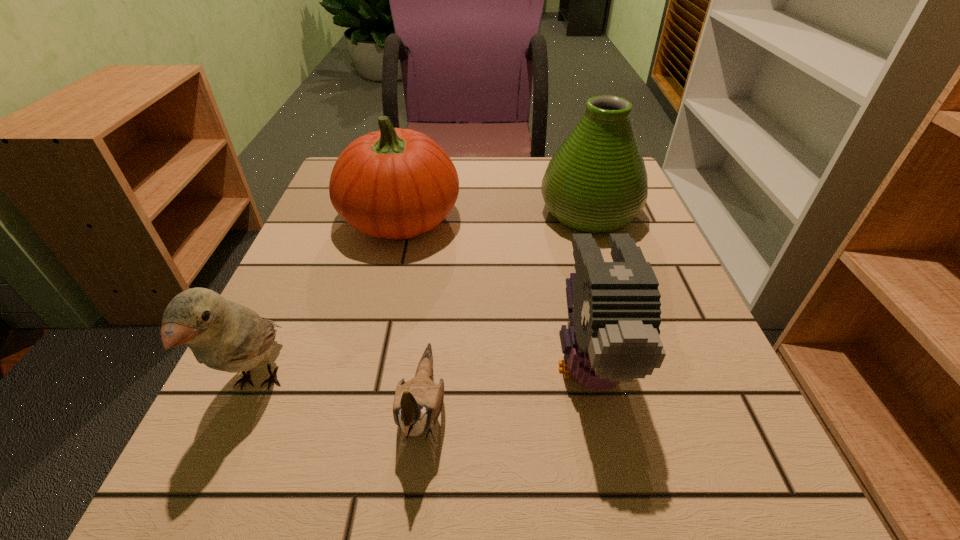
You are a GUI agent. You are given a task and a screenshot of the screen. Output one action in this format:
    pyautogui.click(x=<x>, y=<y>)
    Task: Click on the free spot at the far edge of the desktop
    This screenshot has height=540, width=960.
    Given the screenshot: What is the action you would take?
    pyautogui.click(x=482, y=162)

Locate an element on the screen. Image resolution: width=960 pixels, height=540 pixels. free space at the left edge of the desktop is located at coordinates (348, 265).

The image size is (960, 540). I want to click on free spot at the right edge of the desktop, so click(737, 443).

This screenshot has width=960, height=540. In order to click on vacant region at the near left corner of the desktop in this screenshot , I will do [x=200, y=473].

This screenshot has width=960, height=540. What are the coordinates of `free spot at the near right corner of the desktop` in the screenshot? It's located at (672, 466).

Find the location of a particular element. This screenshot has height=540, width=960. vacant region between the second bird from left to right and the rightmost bird is located at coordinates (505, 385).

Image resolution: width=960 pixels, height=540 pixels. In order to click on free space between the rightmost bird and the pumpkin in this screenshot , I will do `click(493, 291)`.

Where is `free space that is in between the pumpkin and the second bird from right to left`? The image size is (960, 540). free space that is in between the pumpkin and the second bird from right to left is located at coordinates (412, 313).

I want to click on free spot between the vase and the shortest object, so click(506, 310).

I want to click on free space that is in between the vase and the leftmost bird, so click(423, 299).